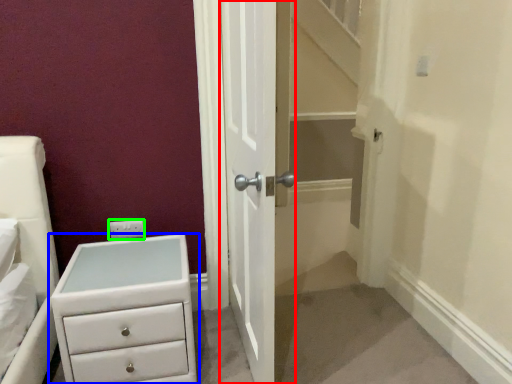
Question: Which object is positioned closest to door (highlighted by a red box)? Select from chest of drawers (highlighted by a blue box) and electric outlet (highlighted by a green box).

Choices:
 (A) chest of drawers
 (B) electric outlet

Answer: (A)